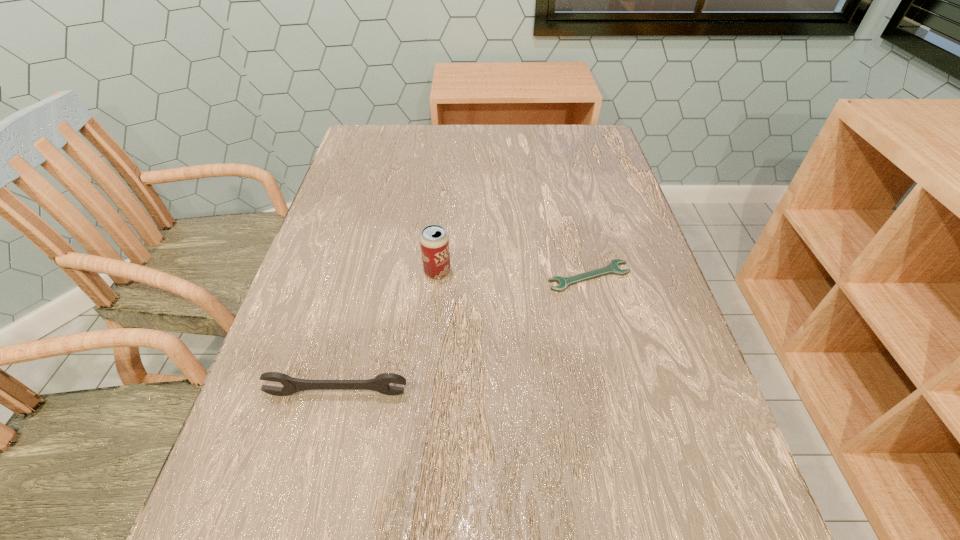
Where is `object that is at the right edge`? The height and width of the screenshot is (540, 960). object that is at the right edge is located at coordinates (612, 268).

The width and height of the screenshot is (960, 540). In the image, there is a desktop. Identify the location of vacant space at the far edge. (456, 158).

At what (x,y) coordinates should I click in order to perform the action: click on free space at the left edge of the desktop. Please return your answer as a coordinate pair (x, y). Looking at the image, I should click on (356, 215).

In the image, there is a desktop. Where is `free space at the right edge`? The height and width of the screenshot is (540, 960). free space at the right edge is located at coordinates (602, 215).

This screenshot has width=960, height=540. In the image, there is a desktop. Find the location of `free region at the far left corner`. free region at the far left corner is located at coordinates (382, 135).

Image resolution: width=960 pixels, height=540 pixels. I want to click on blank space at the far right corner of the desktop, so click(x=602, y=132).

The width and height of the screenshot is (960, 540). I want to click on vacant area that lies between the second shortest object and the tallest object, so click(x=387, y=333).

Locate an element on the screen. The height and width of the screenshot is (540, 960). vacant space that's between the beer can and the leftmost object is located at coordinates 387,333.

At what (x,y) coordinates should I click in order to perform the action: click on free spot between the nearest object and the beer can. Please return your answer as a coordinate pair (x, y). Looking at the image, I should click on (387, 333).

Locate an element on the screen. This screenshot has width=960, height=540. unoccupied position between the shorter wrench and the left wrench is located at coordinates (464, 335).